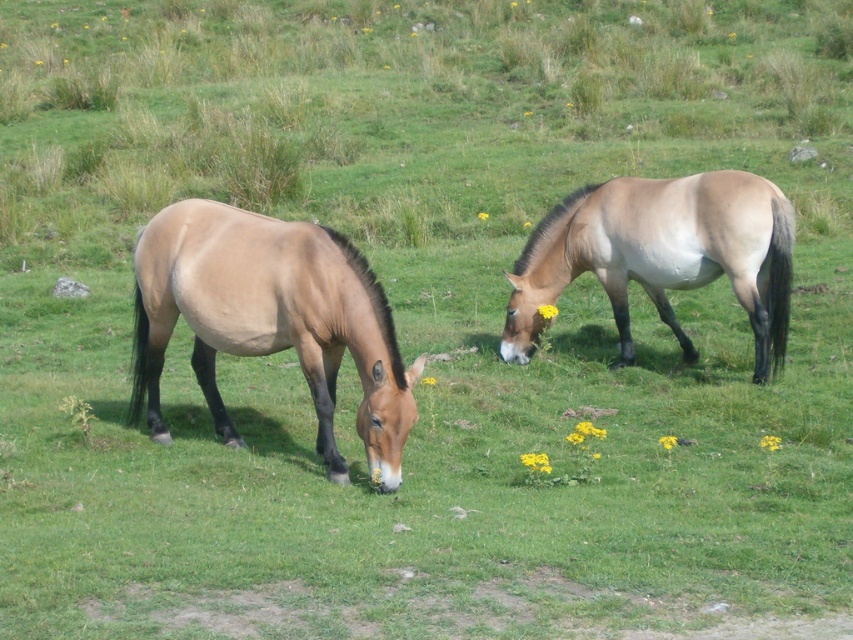
You are a photographer trying to capture a photo of both the brown matte horse at left and the light brown glossy horse at right. Since you want them both in the frame, can you tell me which horse is closer to the left edge of the photo?

The brown matte horse at left is positioned to the left of the light brown glossy horse at right, so the brown matte horse at left will be closer to the left edge of the photo.

In the scene shown: You are a photographer trying to capture a photo of both the brown matte horse at left and the light brown glossy horse at right. Since you want to include both in the frame, which horse is positioned lower in the image?

The brown matte horse at left is positioned lower than the light brown glossy horse at right, so it will appear lower in the photo.